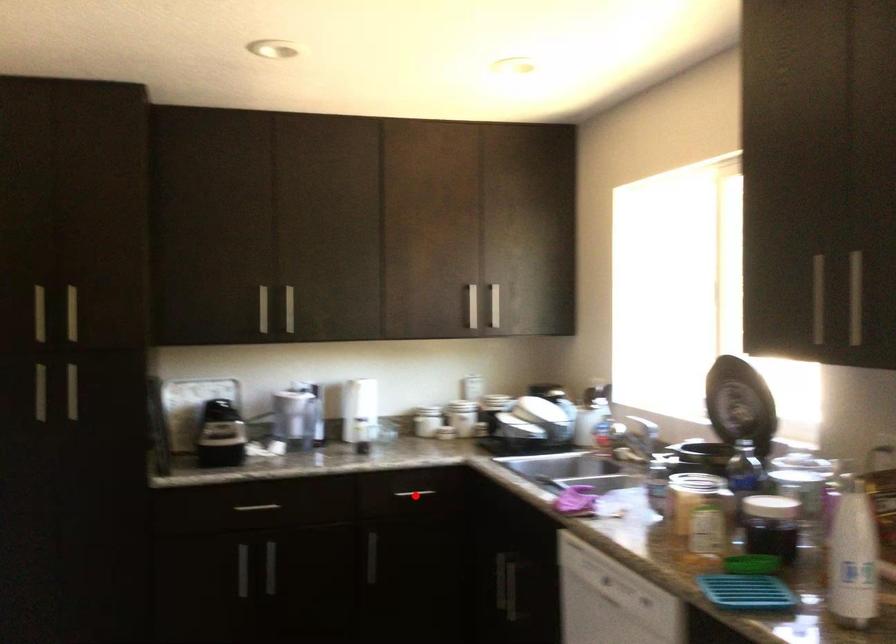
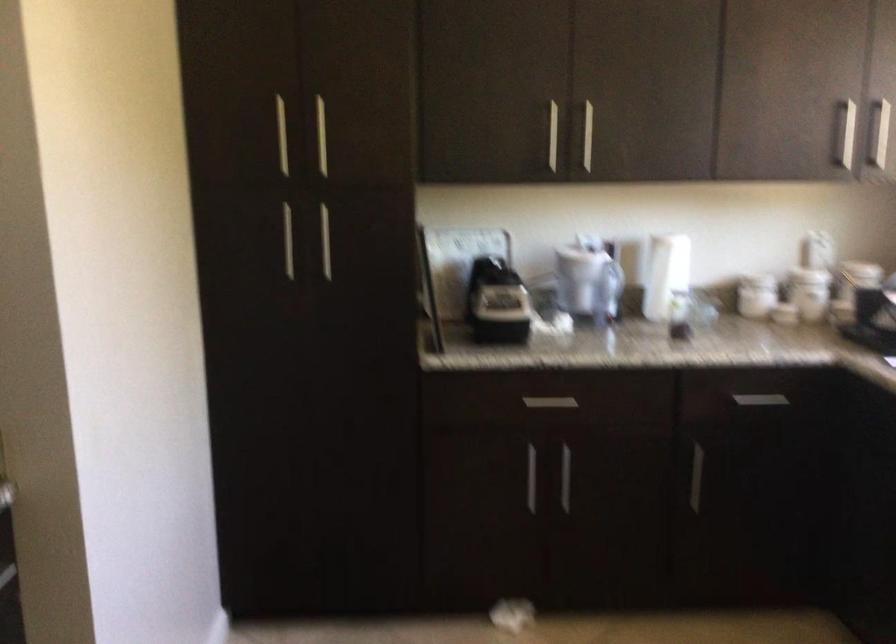
In the second image, find the point that corresponds to the highlighted location in the first image.

(760, 400)